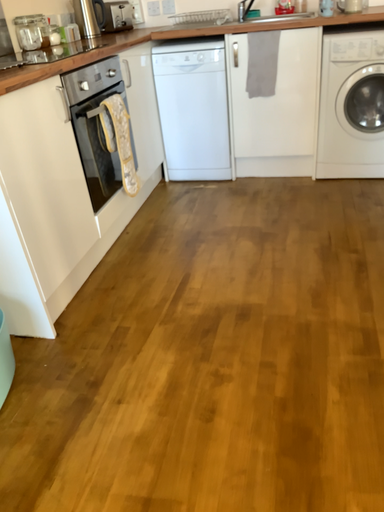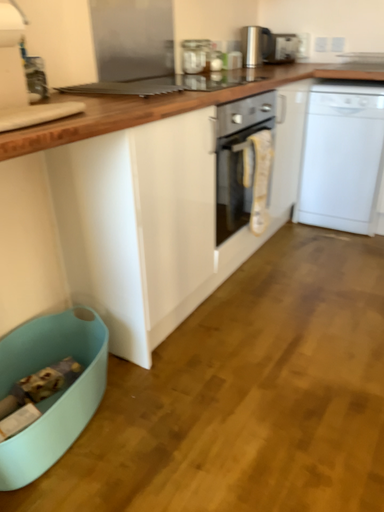
Question: How did the camera likely rotate when shooting the video?

Choices:
 (A) rotated left
 (B) rotated right

Answer: (A)